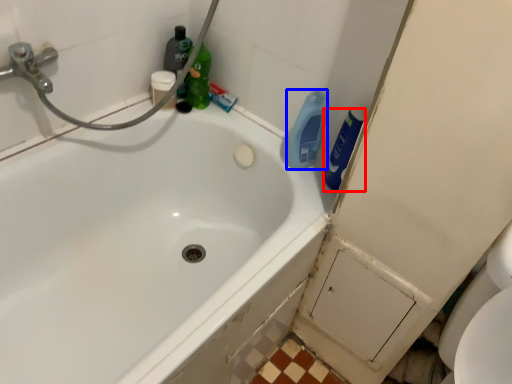
Question: Among these objects, which one is farthest to the camera, cleaning product (highlighted by a red box) or cleaning product (highlighted by a blue box)?

Choices:
 (A) cleaning product
 (B) cleaning product

Answer: (B)